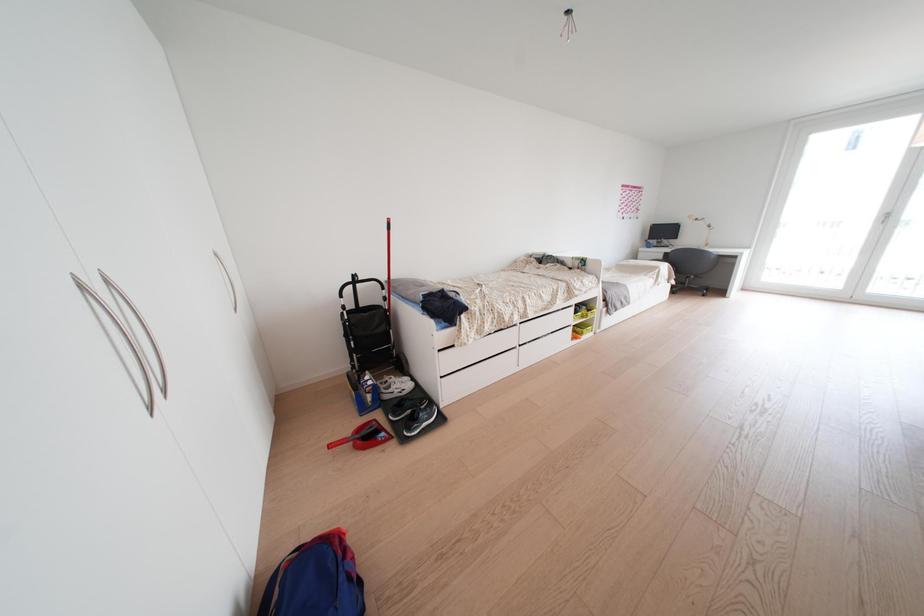
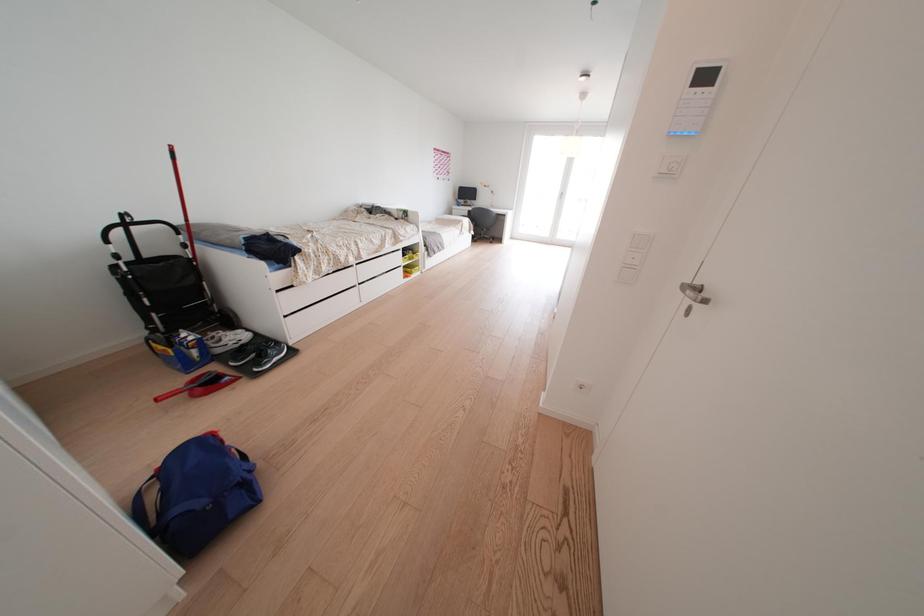
Question: The camera is either moving clockwise (left) or counter-clockwise (right) around the object. The first image is from the beginning of the video and the second image is from the end. Is the camera moving left or right when shooting the video?

Choices:
 (A) Left
 (B) Right

Answer: (A)